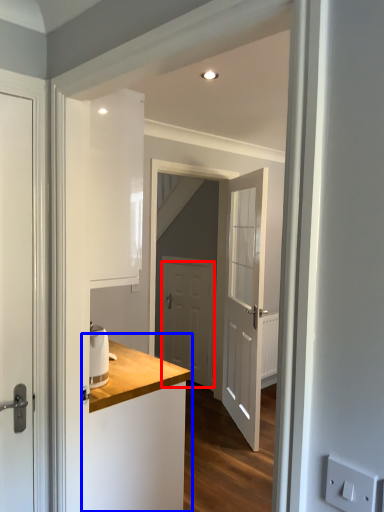
Question: Which point is closer to the camera, door (highlighted by a red box) or counter (highlighted by a blue box)?

Choices:
 (A) door
 (B) counter

Answer: (B)